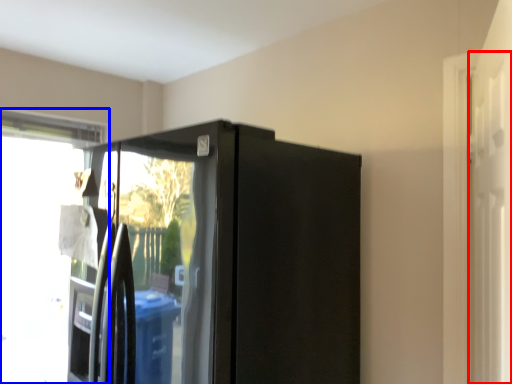
Question: Which object is further to the camera taking this photo, screen door (highlighted by a red box) or window (highlighted by a blue box)?

Choices:
 (A) screen door
 (B) window

Answer: (B)